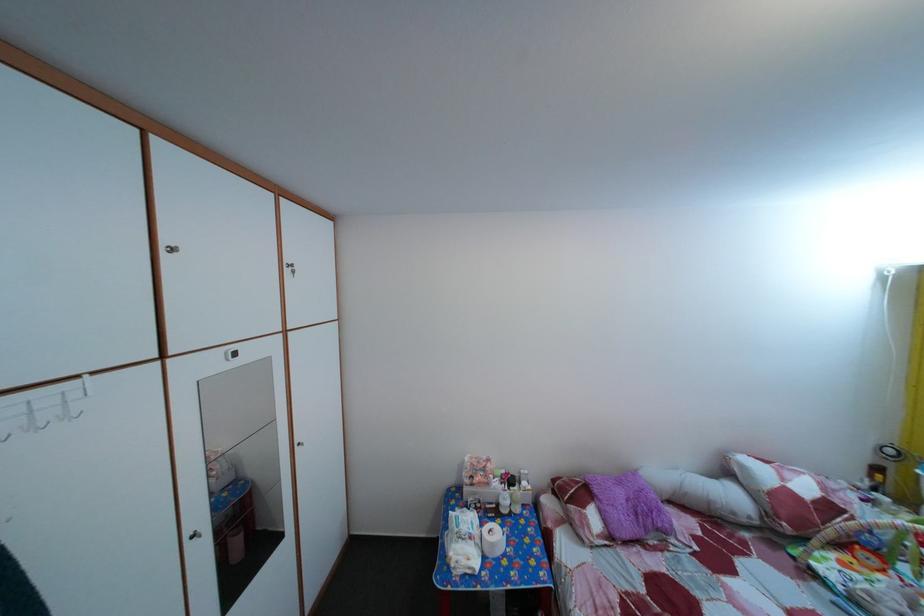
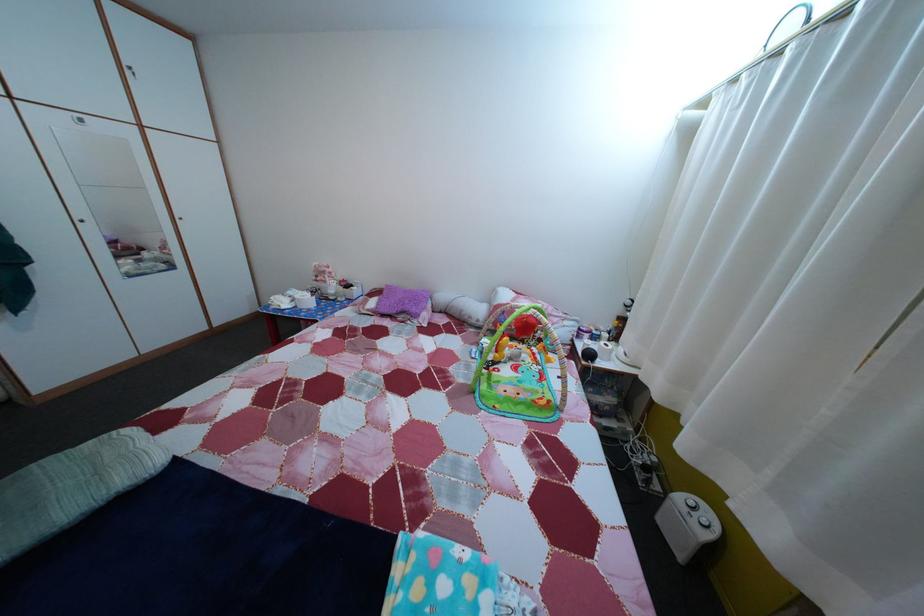
Question: In a continuous first-person perspective shot, in which direction is the camera moving?

Choices:
 (A) Left
 (B) Right
 (C) Forward
 (D) Backward

Answer: (B)